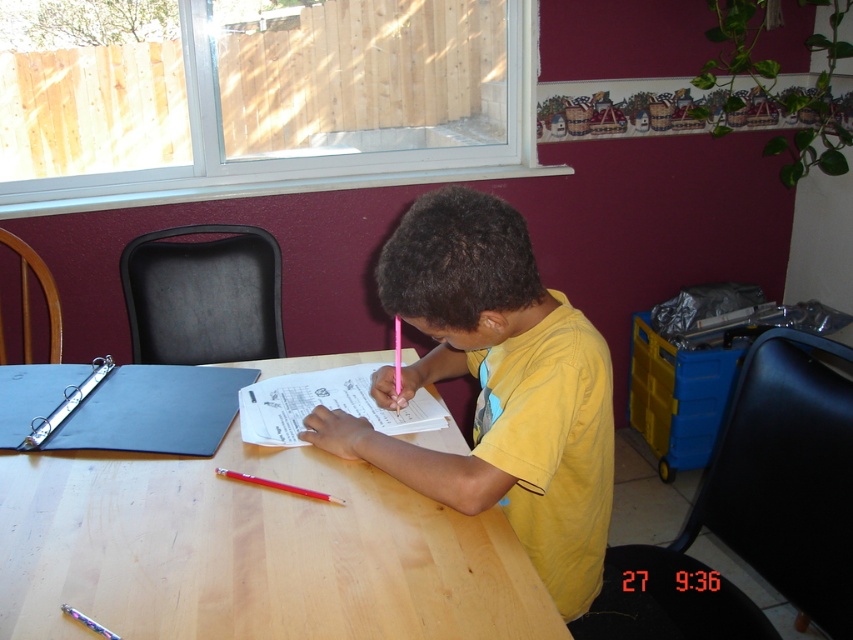
Question: Based on their relative distances, which object is farther from the blue fabric binder at upper left?

Choices:
 (A) white paper at center
 (B) light brown wood table at center
 (C) yellow matte shirt at center
 (D) red plastic pen at table center

Answer: (C)

Question: Which object appears farthest from the camera in this image?

Choices:
 (A) red plastic pen at table center
 (B) blue fabric binder at upper left
 (C) light brown wood table at center
 (D) white paper at center

Answer: (D)

Question: Is light brown wood table at center thinner than red plastic pen at table center?

Choices:
 (A) yes
 (B) no

Answer: (B)

Question: Is blue fabric binder at upper left to the right of white paper at center from the viewer's perspective?

Choices:
 (A) yes
 (B) no

Answer: (B)

Question: Which of the following is the closest to the observer?

Choices:
 (A) (431, 333)
 (B) (398, 429)

Answer: (A)

Question: Is yellow matte shirt at center below blue fabric binder at upper left?

Choices:
 (A) no
 (B) yes

Answer: (A)